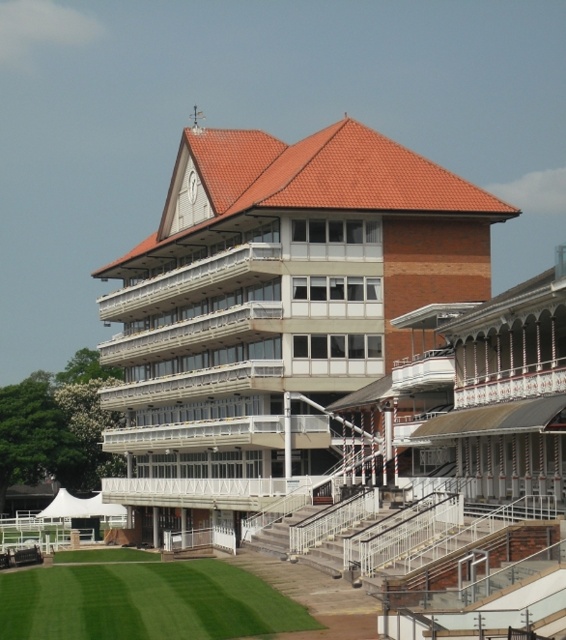
Which is below, brown brick building at center or green grass at lower left?

Positioned lower is green grass at lower left.

Can you confirm if brown brick building at center is smaller than green grass at lower left?

Actually, brown brick building at center might be larger than green grass at lower left.

The height and width of the screenshot is (640, 566). What are the coordinates of `brown brick building at center` in the screenshot? It's located at (275, 307).

Where is `brown brick building at center`? The image size is (566, 640). brown brick building at center is located at coordinates (275, 307).